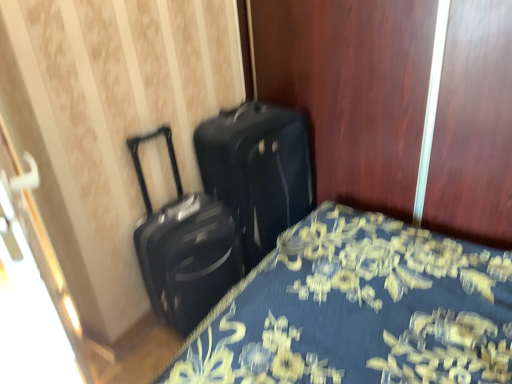
At what (x,y) coordinates should I click in order to perform the action: click on blue floral fabric bed at lower left. Please return your answer as a coordinate pair (x, y). The height and width of the screenshot is (384, 512). Looking at the image, I should click on (359, 310).

Considering the sizes of objects blue floral fabric bed at lower left and black matte suitcase at center, arranged as the second suitcase when viewed from the left, in the image provided, who is shorter, blue floral fabric bed at lower left or black matte suitcase at center, arranged as the second suitcase when viewed from the left,?

blue floral fabric bed at lower left.

Can you confirm if blue floral fabric bed at lower left is smaller than black matte suitcase at center, arranged as the second suitcase when viewed from the left?

No.

Do you think black matte suitcase at center, acting as the 1th suitcase starting from the left, is within blue floral fabric bed at lower left, or outside of it?

black matte suitcase at center, acting as the 1th suitcase starting from the left, is outside blue floral fabric bed at lower left.

Which is behind, black matte suitcase at center, acting as the 1th suitcase starting from the left, or blue floral fabric bed at lower left?

black matte suitcase at center, acting as the 1th suitcase starting from the left.

Which is behind, point (220, 259) or point (309, 300)?

Positioned behind is point (220, 259).

From the image's perspective, is black matte suitcase at center, the second suitcase when ordered from right to left, below blue floral fabric bed at lower left?

No, from the image's perspective, black matte suitcase at center, the second suitcase when ordered from right to left, is not below blue floral fabric bed at lower left.

Between point (166, 220) and point (246, 73), which one is positioned in front?

The point (166, 220) is closer.

Could you measure the distance between black matte suitcase at center, the second suitcase when ordered from right to left, and black matte suitcase at center, arranged as the second suitcase when viewed from the left?

The distance of black matte suitcase at center, the second suitcase when ordered from right to left, from black matte suitcase at center, arranged as the second suitcase when viewed from the left, is 22.42 centimeters.

Can we say black matte suitcase at center, acting as the 1th suitcase starting from the left, lies outside black matte suitcase at center, arranged as the 1th suitcase when viewed from the right?

Absolutely, black matte suitcase at center, acting as the 1th suitcase starting from the left, is external to black matte suitcase at center, arranged as the 1th suitcase when viewed from the right.

Between black matte suitcase at center, the second suitcase when ordered from right to left, and black matte suitcase at center, arranged as the second suitcase when viewed from the left, which one is positioned behind?

black matte suitcase at center, arranged as the second suitcase when viewed from the left.

Considering the sizes of black matte suitcase at center, arranged as the second suitcase when viewed from the left, and blue floral fabric bed at lower left in the image, is black matte suitcase at center, arranged as the second suitcase when viewed from the left, wider or thinner than blue floral fabric bed at lower left?

black matte suitcase at center, arranged as the second suitcase when viewed from the left, is thinner than blue floral fabric bed at lower left.

From the image's perspective, is black matte suitcase at center, arranged as the 1th suitcase when viewed from the right, located above blue floral fabric bed at lower left?

Indeed, from the image's perspective, black matte suitcase at center, arranged as the 1th suitcase when viewed from the right, is shown above blue floral fabric bed at lower left.

Which is behind, point (260, 251) or point (496, 304)?

The point (260, 251) is farther.

Does black matte suitcase at center, arranged as the 1th suitcase when viewed from the right, have a smaller size compared to blue floral fabric bed at lower left?

Yes.

Considering the points (256, 118) and (193, 239), which point is behind, point (256, 118) or point (193, 239)?

The point (256, 118) is behind.

Looking at the image, does black matte suitcase at center, arranged as the second suitcase when viewed from the left, seem bigger or smaller compared to black matte suitcase at center, acting as the 1th suitcase starting from the left?

black matte suitcase at center, arranged as the second suitcase when viewed from the left, is bigger than black matte suitcase at center, acting as the 1th suitcase starting from the left.

From the image's perspective, between black matte suitcase at center, arranged as the second suitcase when viewed from the left, and black matte suitcase at center, acting as the 1th suitcase starting from the left, who is located below?

black matte suitcase at center, acting as the 1th suitcase starting from the left, is shown below in the image.

You are a GUI agent. You are given a task and a screenshot of the screen. Output one action in this format:
    pyautogui.click(x=<x>, y=<y>)
    Task: Click on the suitcase below the black matte suitcase at center, acting as the 1th suitcase starting from the left (from a real-world perspective)
    The image size is (512, 384).
    Given the screenshot: What is the action you would take?
    pyautogui.click(x=257, y=170)

From the image's perspective, which one is positioned higher, blue floral fabric bed at lower left or black matte suitcase at center, acting as the 1th suitcase starting from the left?

black matte suitcase at center, acting as the 1th suitcase starting from the left.

Would you say blue floral fabric bed at lower left is a long distance from black matte suitcase at center, acting as the 1th suitcase starting from the left?

That's not correct — blue floral fabric bed at lower left is a little close to black matte suitcase at center, acting as the 1th suitcase starting from the left.

The height and width of the screenshot is (384, 512). Find the location of `the 1st suitcase behind when counting from the blue floral fabric bed at lower left`. the 1st suitcase behind when counting from the blue floral fabric bed at lower left is located at coordinates (185, 249).

Which is more to the right, blue floral fabric bed at lower left or black matte suitcase at center, the second suitcase when ordered from right to left?

From the viewer's perspective, blue floral fabric bed at lower left appears more on the right side.

This screenshot has width=512, height=384. I want to click on suitcase that is the 1st object to the left of the blue floral fabric bed at lower left, starting at the anchor, so click(257, 170).

There is a blue floral fabric bed at lower left. Where is `the 1st suitcase above it (from the image's perspective)`? This screenshot has height=384, width=512. the 1st suitcase above it (from the image's perspective) is located at coordinates (185, 249).

Based on their spatial positions, is black matte suitcase at center, arranged as the 1th suitcase when viewed from the right, or black matte suitcase at center, the second suitcase when ordered from right to left, further from blue floral fabric bed at lower left?

black matte suitcase at center, the second suitcase when ordered from right to left.

In the scene shown: Looking at the image, which one is located closer to black matte suitcase at center, acting as the 1th suitcase starting from the left, black matte suitcase at center, arranged as the second suitcase when viewed from the left, or blue floral fabric bed at lower left?

Based on the image, black matte suitcase at center, arranged as the second suitcase when viewed from the left, appears to be nearer to black matte suitcase at center, acting as the 1th suitcase starting from the left.

Estimate the real-world distances between objects in this image. Which object is closer to black matte suitcase at center, arranged as the 1th suitcase when viewed from the right, blue floral fabric bed at lower left or black matte suitcase at center, acting as the 1th suitcase starting from the left?

Among the two, black matte suitcase at center, acting as the 1th suitcase starting from the left, is located nearer to black matte suitcase at center, arranged as the 1th suitcase when viewed from the right.

From the picture: Which object lies nearer to the anchor point black matte suitcase at center, arranged as the 1th suitcase when viewed from the right, black matte suitcase at center, the second suitcase when ordered from right to left, or blue floral fabric bed at lower left?

black matte suitcase at center, the second suitcase when ordered from right to left, is closer to black matte suitcase at center, arranged as the 1th suitcase when viewed from the right.

From the image, which object appears to be nearer to black matte suitcase at center, the second suitcase when ordered from right to left, blue floral fabric bed at lower left or black matte suitcase at center, arranged as the second suitcase when viewed from the left?

Among the two, black matte suitcase at center, arranged as the second suitcase when viewed from the left, is located nearer to black matte suitcase at center, the second suitcase when ordered from right to left.

From the image, which object appears to be farther from blue floral fabric bed at lower left, black matte suitcase at center, the second suitcase when ordered from right to left, or black matte suitcase at center, arranged as the second suitcase when viewed from the left?

Based on the image, black matte suitcase at center, the second suitcase when ordered from right to left, appears to be further to blue floral fabric bed at lower left.

At what (x,y) coordinates should I click in order to perform the action: click on suitcase between blue floral fabric bed at lower left and black matte suitcase at center, arranged as the 1th suitcase when viewed from the right, along the z-axis. Please return your answer as a coordinate pair (x, y). Looking at the image, I should click on (185, 249).